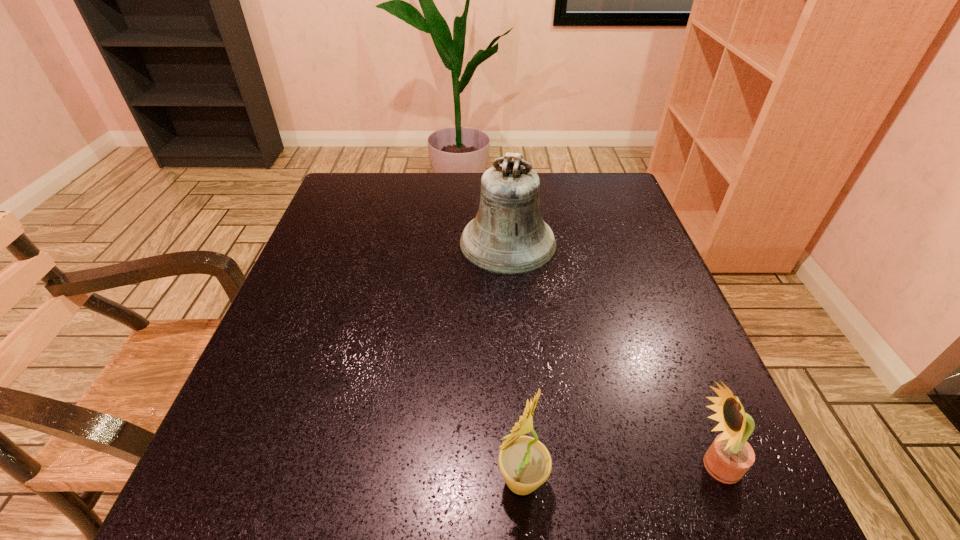
Find the location of a particular element. The height and width of the screenshot is (540, 960). object that is positioned at the far edge is located at coordinates (508, 236).

At what (x,y) coordinates should I click in order to perform the action: click on object that is at the right edge. Please return your answer as a coordinate pair (x, y). Image resolution: width=960 pixels, height=540 pixels. Looking at the image, I should click on (730, 456).

Find the location of `object situated at the near right corner`. object situated at the near right corner is located at coordinates (730, 456).

In the image, there is a desktop. In order to click on vacant space at the far edge in this screenshot , I will do `click(479, 205)`.

You are a GUI agent. You are given a task and a screenshot of the screen. Output one action in this format:
    pyautogui.click(x=<x>, y=<y>)
    Task: Click on the free region at the near edge of the desktop
    
    Given the screenshot: What is the action you would take?
    pyautogui.click(x=596, y=493)

Where is `vacant space at the left edge of the desktop`? The width and height of the screenshot is (960, 540). vacant space at the left edge of the desktop is located at coordinates (317, 421).

The image size is (960, 540). What are the coordinates of `blank space at the right edge` in the screenshot? It's located at (631, 291).

Image resolution: width=960 pixels, height=540 pixels. What are the coordinates of `vacant space at the far right corner of the desktop` in the screenshot? It's located at (585, 191).

You are a GUI agent. You are given a task and a screenshot of the screen. Output one action in this format:
    pyautogui.click(x=<x>, y=<y>)
    Task: Click on the free space at the near right corner of the desktop
    The width and height of the screenshot is (960, 540).
    Given the screenshot: What is the action you would take?
    pyautogui.click(x=709, y=481)

Identify the location of empty space that is in between the left sunflower and the bell. Image resolution: width=960 pixels, height=540 pixels. (515, 361).